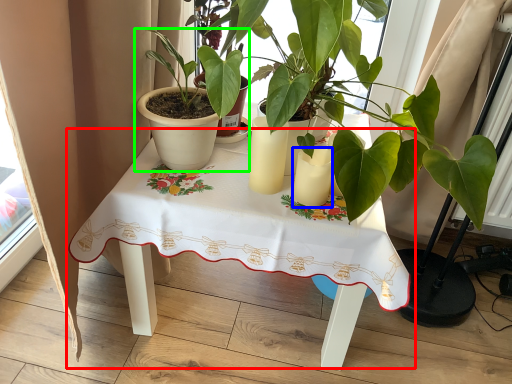
Question: Which object is positioned farthest from table (highlighted by a red box)? Select from candle holder (highlighted by a blue box) and houseplant (highlighted by a green box).

Choices:
 (A) candle holder
 (B) houseplant

Answer: (A)